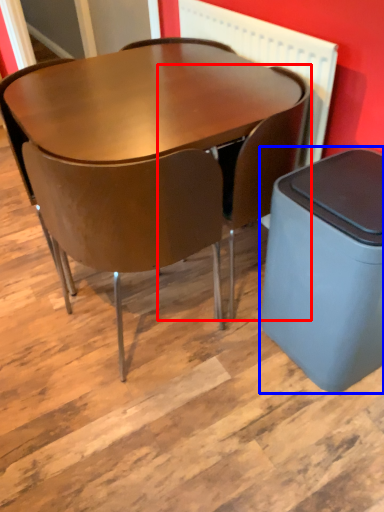
Question: Which point is further to the camera, chair (highlighted by a red box) or waste container (highlighted by a blue box)?

Choices:
 (A) chair
 (B) waste container

Answer: (A)